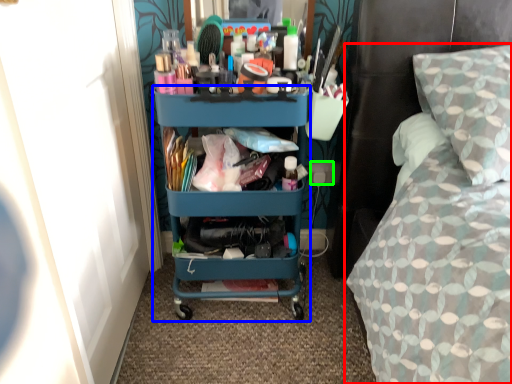
Question: Considering the real-world distances, which object is closest to bed (highlighted by a red box)? desk (highlighted by a blue box) or power outlet (highlighted by a green box).

Choices:
 (A) desk
 (B) power outlet

Answer: (A)